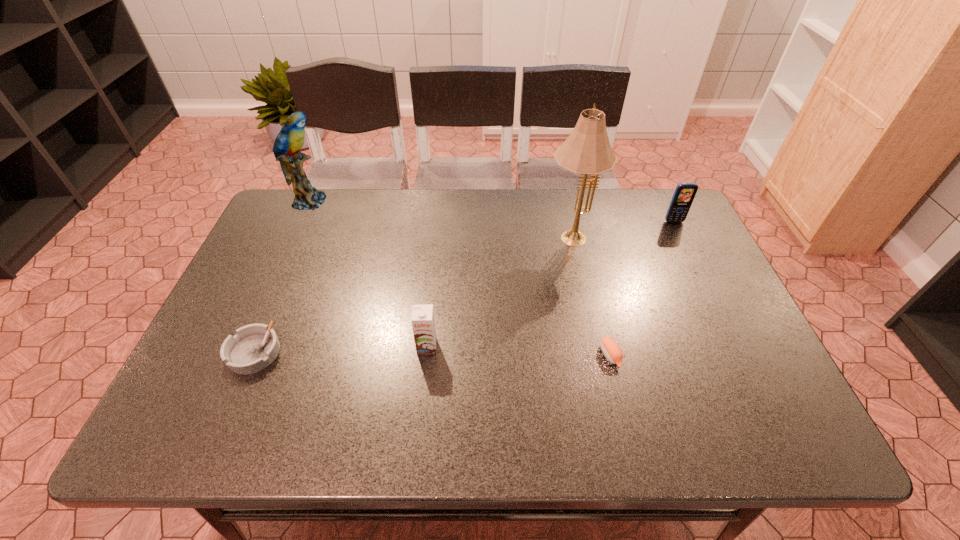
Where is `free space that satisfies the following two spatial constraints: 1. on the face of the farthest object; 2. on the left side of the sushi`? The image size is (960, 540). free space that satisfies the following two spatial constraints: 1. on the face of the farthest object; 2. on the left side of the sushi is located at coordinates (239, 355).

Where is `free point that satisfies the following two spatial constraints: 1. on the face of the sushi; 2. on the right side of the parrot`? free point that satisfies the following two spatial constraints: 1. on the face of the sushi; 2. on the right side of the parrot is located at coordinates (239, 355).

Locate an element on the screen. The height and width of the screenshot is (540, 960). free space in the image that satisfies the following two spatial constraints: 1. on the face of the parrot; 2. on the right side of the sushi is located at coordinates (239, 355).

Find the location of a particular element. This screenshot has width=960, height=540. vacant position in the image that satisfies the following two spatial constraints: 1. on the face of the lampshade; 2. on the right side of the farthest object is located at coordinates (294, 235).

At what (x,y) coordinates should I click in order to perform the action: click on blank space that satisfies the following two spatial constraints: 1. on the face of the lampshade; 2. on the left side of the parrot. Please return your answer as a coordinate pair (x, y). Looking at the image, I should click on (294, 235).

Locate an element on the screen. This screenshot has height=540, width=960. free spot that satisfies the following two spatial constraints: 1. on the face of the fifth shortest object; 2. on the right side of the ashtray is located at coordinates (241, 352).

Locate an element on the screen. free location that satisfies the following two spatial constraints: 1. on the face of the tallest object; 2. on the left side of the second tallest object is located at coordinates (294, 235).